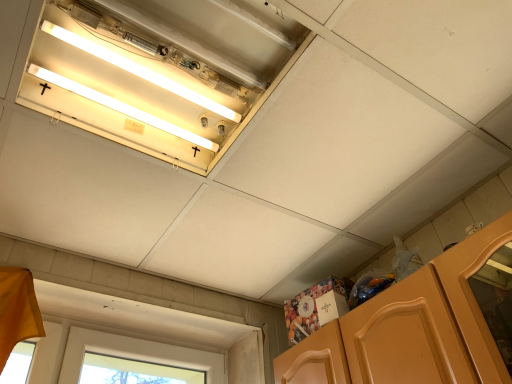
Locate an element on the screen. This screenshot has height=384, width=512. white matte window at lower left is located at coordinates (143, 321).

This screenshot has height=384, width=512. What do you see at coordinates (143, 321) in the screenshot?
I see `white matte window at lower left` at bounding box center [143, 321].

Where is `white matte window at lower left`? white matte window at lower left is located at coordinates (143, 321).